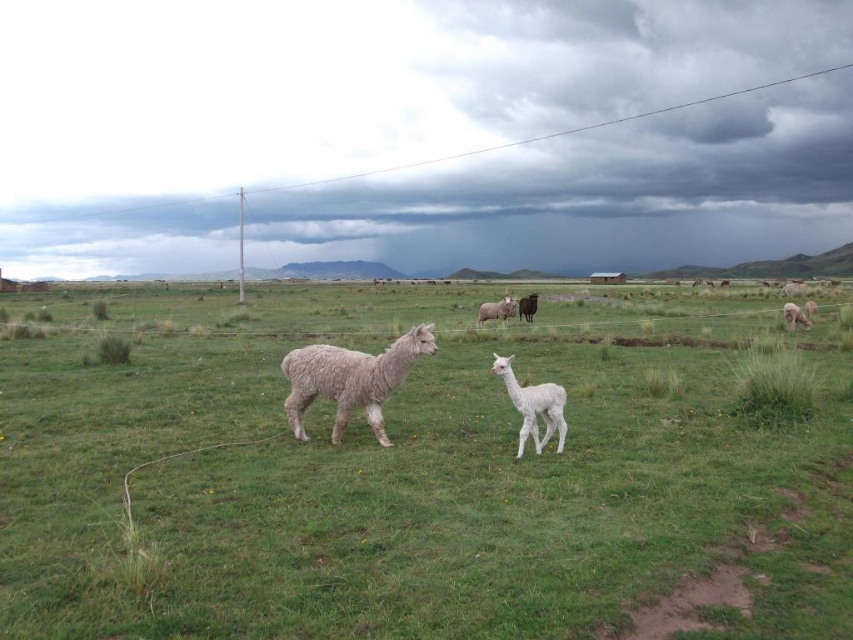
You are an alpaca herder looking at the image. You notice the cloudy sky at upper center and the fuzzy white alpaca at center. Which object is closer to you, the observer?

The fuzzy white alpaca at center is closer to you than the cloudy sky at upper center because the alpaca is positioned behind the sky in the image.

You are a farmer checking the field. You notice the green soft grass at center and the fuzzy white alpaca at center. Which one takes up more space horizontally in the image?

The green soft grass at center takes up more space horizontally than the fuzzy white alpaca at center because its width is larger.